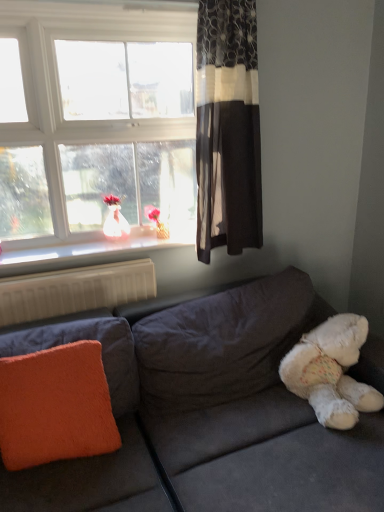
In order to click on vacant area on top of white glossy window sill at upper left (from a real-world perspective) in this screenshot , I will do `click(97, 243)`.